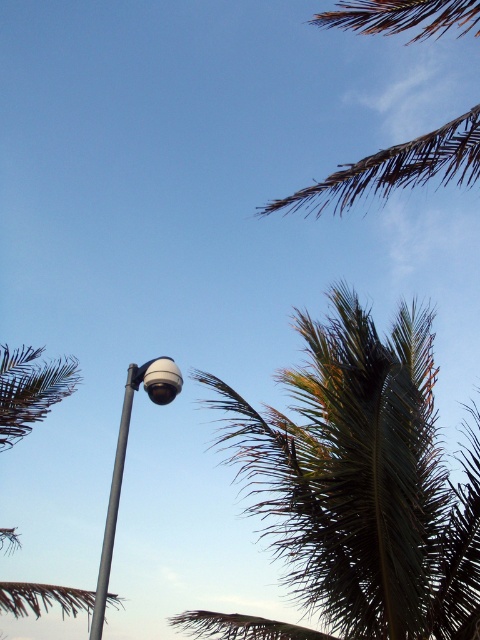
Is brown/dry palm leaf at upper right above sleek metallic street light at upper center?

Indeed, brown/dry palm leaf at upper right is positioned over sleek metallic street light at upper center.

Does brown/dry palm leaf at upper right have a greater width compared to sleek metallic street light at upper center?

Yes.

Identify the location of brown/dry palm leaf at upper right. (396, 168).

This screenshot has height=640, width=480. Find the location of `brown/dry palm leaf at upper right`. brown/dry palm leaf at upper right is located at coordinates (396, 168).

Is point (381, 406) closer to viewer compared to point (110, 524)?

That is True.

This screenshot has height=640, width=480. What do you see at coordinates (363, 481) in the screenshot?
I see `green leafy palm tree at upper right` at bounding box center [363, 481].

Who is more distant from viewer, [294,483] or [96,605]?

Point [294,483]

Find the location of `green leafy palm tree at upper right`. green leafy palm tree at upper right is located at coordinates (363, 481).

Does sleek metallic street light at upper center appear on the left side of metallic gray pole at center?

Incorrect, sleek metallic street light at upper center is not on the left side of metallic gray pole at center.

Which is in front, point (135, 365) or point (97, 632)?

Point (97, 632)

The height and width of the screenshot is (640, 480). Describe the element at coordinates (123, 461) in the screenshot. I see `sleek metallic street light at upper center` at that location.

Image resolution: width=480 pixels, height=640 pixels. Find the location of `sleek metallic street light at upper center`. sleek metallic street light at upper center is located at coordinates (123, 461).